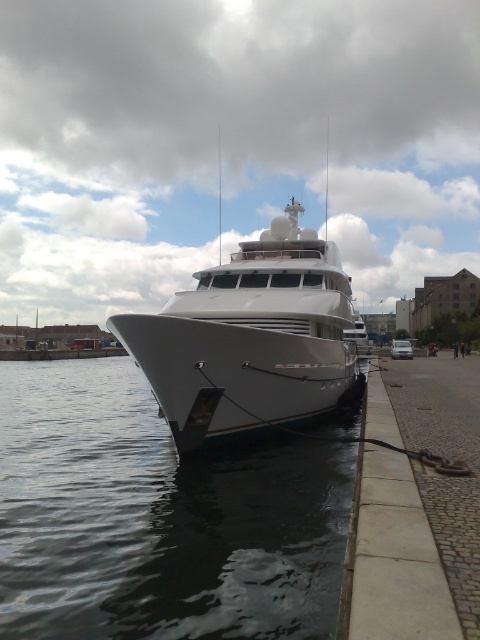
You are a photographer planning to take a photo of the white glossy yacht at center from the dock. You notice the clear water at lower left in the foreground. Will the yacht appear taller than the water in the photo?

The clear water at lower left is shorter than the white glossy yacht at center, so yes, the yacht will appear taller than the water in the photo.

You are a marine engineer assessing the docking space of the yacht. You need to ensure there is enough space between the clear water at lower left and the white glossy yacht at center for a 4.2 meter long maintenance boat to maneuver safely. Is the distance sufficient?

The clear water at lower left is 4.36 meters from the white glossy yacht at center. Since the maintenance boat is 4.2 meters long, the distance is sufficient for safe maneuvering as it is slightly longer than the required space.